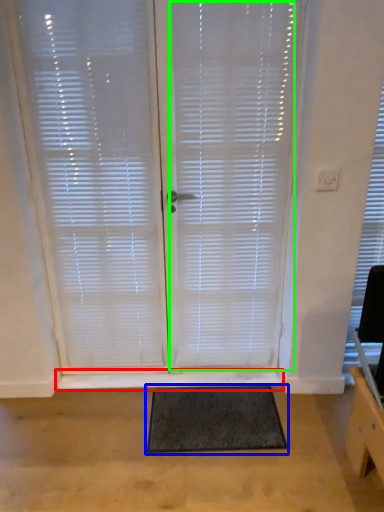
Question: Which object is the closest to the window sill (highlighted by a red box)? Choose among these: doormat (highlighted by a blue box) or blind (highlighted by a green box).

Choices:
 (A) doormat
 (B) blind

Answer: (A)